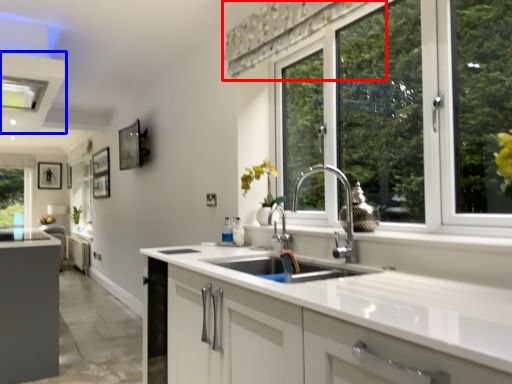
Question: Which point is further to the camera, curtain (highlighted by a red box) or exhaust hood (highlighted by a blue box)?

Choices:
 (A) curtain
 (B) exhaust hood

Answer: (B)